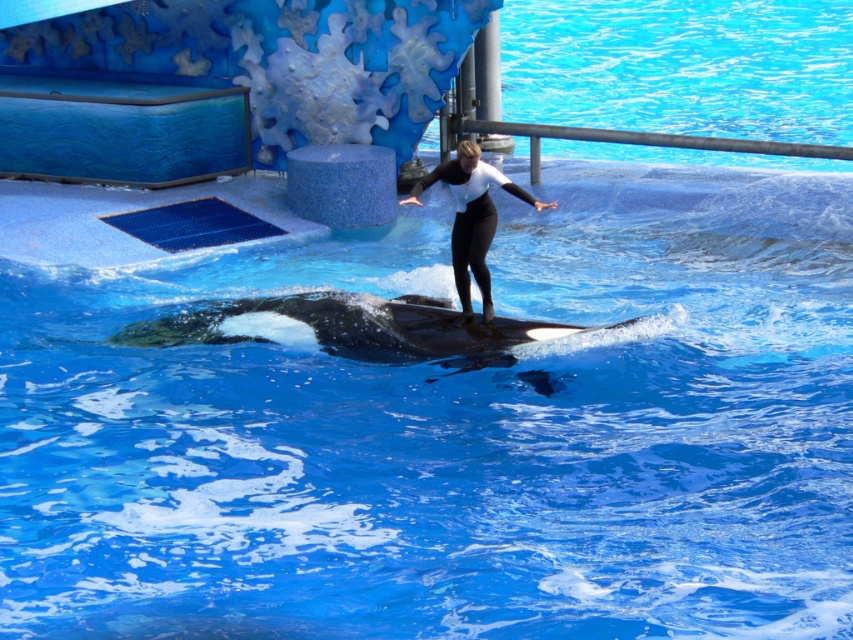
Question: Can you confirm if black smooth whale at center is wider than black matte wetsuit at center?

Choices:
 (A) no
 (B) yes

Answer: (B)

Question: Is black smooth whale at center positioned behind black matte wetsuit at center?

Choices:
 (A) no
 (B) yes

Answer: (B)

Question: Considering the relative positions of black smooth whale at center and black matte wetsuit at center in the image provided, where is black smooth whale at center located with respect to black matte wetsuit at center?

Choices:
 (A) below
 (B) above

Answer: (A)

Question: Which point is farther to the camera?

Choices:
 (A) black matte wetsuit at center
 (B) black smooth whale at center

Answer: (B)